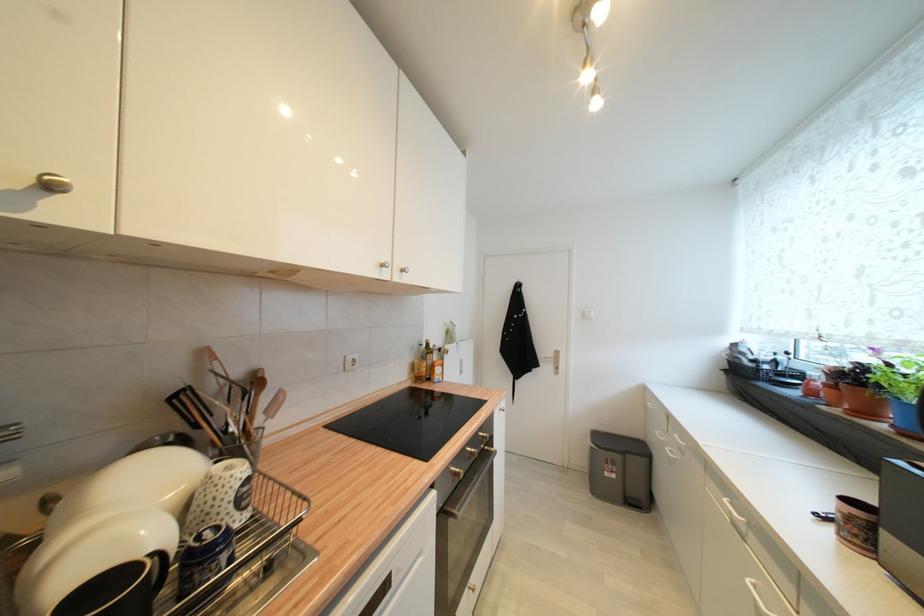
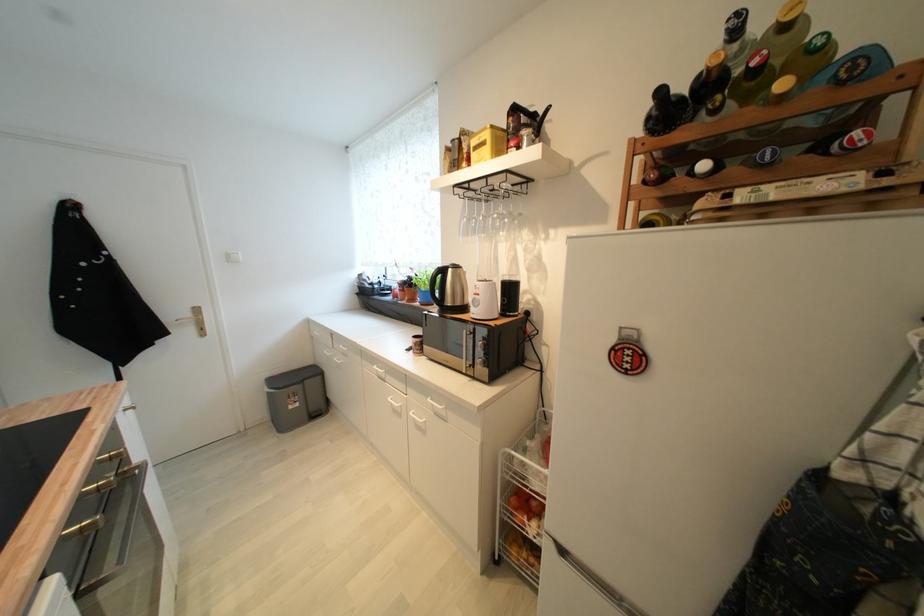
Question: Based on the continuous images, in which direction is the camera rotating? Reply with the corresponding letter.

Choices:
 (A) Left
 (B) Right
 (C) Up
 (D) Down

Answer: (B)